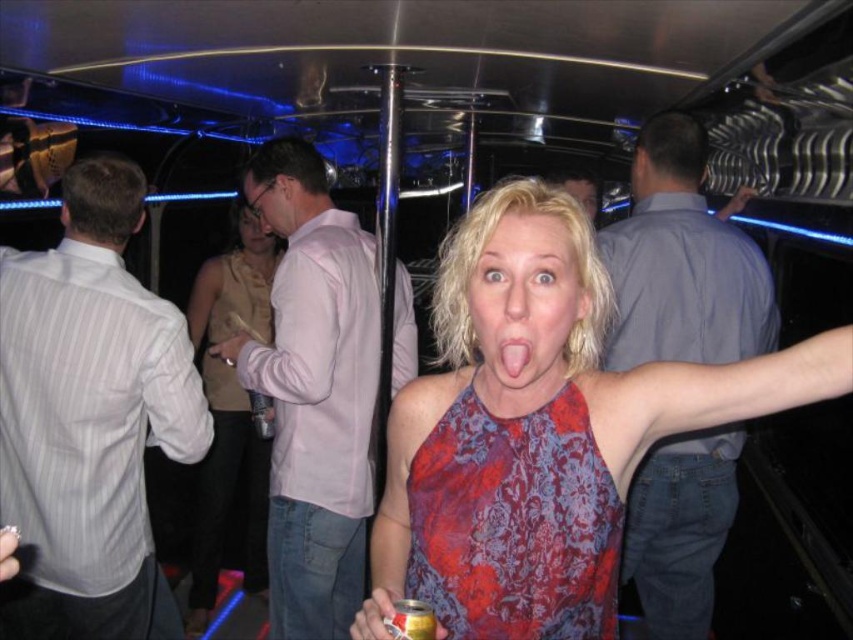
Is point (508, 234) farther from camera compared to point (262, 227)?

No, (508, 234) is in front of (262, 227).

What do you see at coordinates (525, 301) in the screenshot? I see `matte floral dress at center` at bounding box center [525, 301].

Is point (512, 333) in front of point (283, 204)?

Yes.

The height and width of the screenshot is (640, 853). I want to click on matte floral dress at center, so click(x=525, y=301).

In the scene shown: Which is more to the right, matte beige dress at center or blonde hair at center?

From the viewer's perspective, blonde hair at center appears more on the right side.

Between point (254, 502) and point (573, 180), which one is positioned in front?

Positioned in front is point (254, 502).

Is point (209, 472) farther from camera compared to point (596, 204)?

No.

Image resolution: width=853 pixels, height=640 pixels. Find the location of `matte beige dress at center`. matte beige dress at center is located at coordinates (229, 422).

Can you confirm if red floral dress at center is positioned to the right of matte beige face at center?

Correct, you'll find red floral dress at center to the right of matte beige face at center.

Who is lower down, red floral dress at center or matte beige face at center?

red floral dress at center

Locate an element on the screen. red floral dress at center is located at coordinates (514, 524).

Where is `red floral dress at center`? This screenshot has width=853, height=640. red floral dress at center is located at coordinates (514, 524).